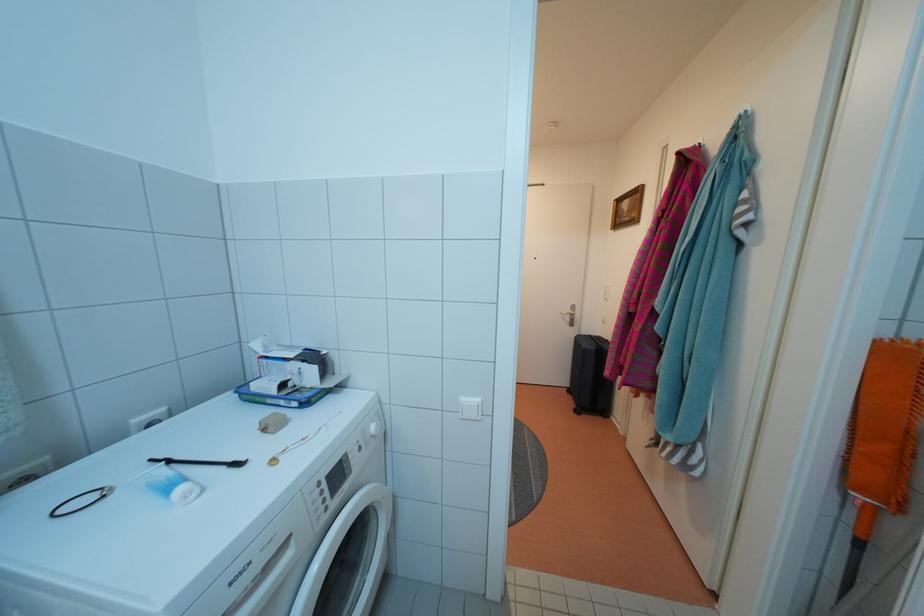
This screenshot has width=924, height=616. What do you see at coordinates (569, 315) in the screenshot? I see `the silver door handle` at bounding box center [569, 315].